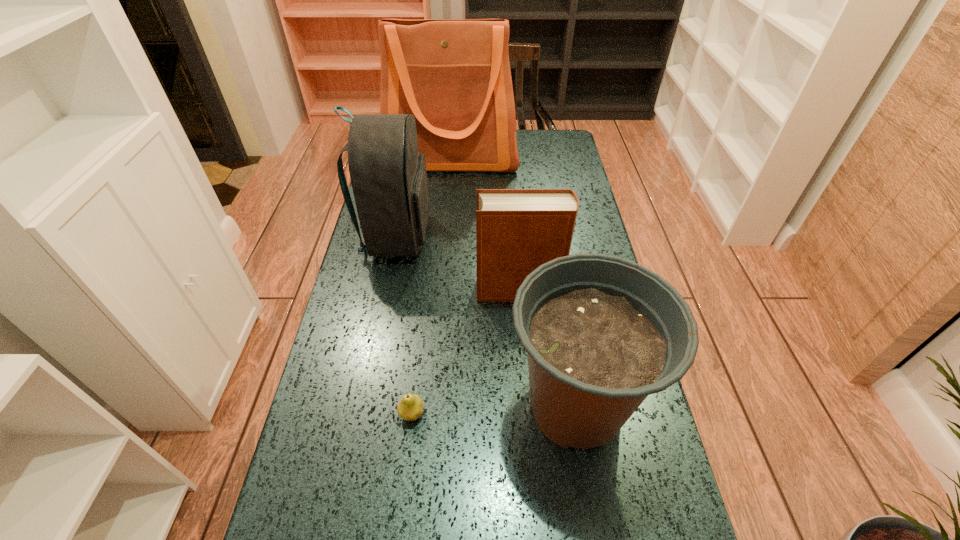
Image resolution: width=960 pixels, height=540 pixels. What are the coordinates of `vacant space located 0.110m on the open cover of the hardback book` in the screenshot? It's located at (439, 290).

Locate an element on the screen. This screenshot has width=960, height=540. free location located 0.060m on the right of the shortest object is located at coordinates pos(451,414).

The image size is (960, 540). In order to click on object at the far edge in this screenshot , I will do `click(453, 75)`.

You are a GUI agent. You are given a task and a screenshot of the screen. Output one action in this format:
    pyautogui.click(x=<x>, y=<y>)
    Task: Click on the shopping bag that is at the left edge
    
    Given the screenshot: What is the action you would take?
    pyautogui.click(x=453, y=75)

Locate an element on the screen. This screenshot has height=540, width=960. backpack that is positioned at the left edge is located at coordinates (388, 175).

Locate an element on the screen. flowerpot at the right edge is located at coordinates (602, 333).

Find the location of `hardback book present at the right edge`. hardback book present at the right edge is located at coordinates 517,230.

Find the location of `object located at the far left corner`. object located at the far left corner is located at coordinates (453, 75).

Locate an element on the screen. The width and height of the screenshot is (960, 540). vacant space at the left edge of the desktop is located at coordinates (372, 390).

The width and height of the screenshot is (960, 540). I want to click on vacant space in between the flowerpot and the pear, so click(x=493, y=410).